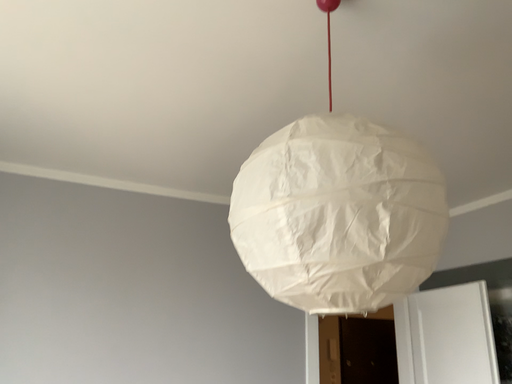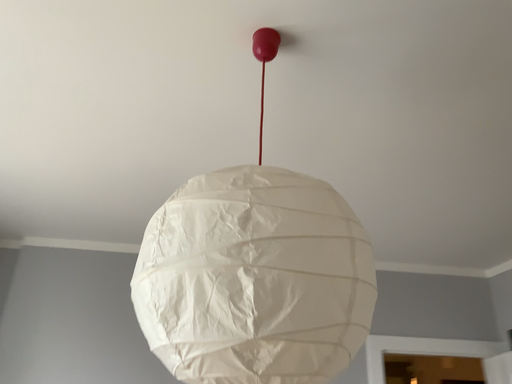
Question: How did the camera likely rotate when shooting the video?

Choices:
 (A) rotated right
 (B) rotated left

Answer: (B)